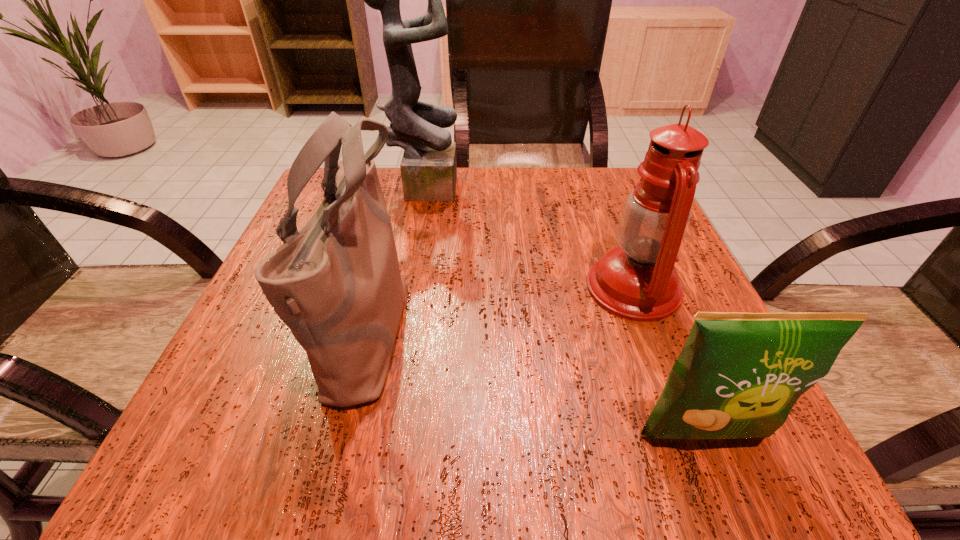
The image size is (960, 540). I want to click on the farthest object, so click(428, 167).

The image size is (960, 540). What are the coordinates of `sculpture` in the screenshot? It's located at (428, 167).

Image resolution: width=960 pixels, height=540 pixels. I want to click on shoulder bag, so click(x=336, y=283).

Find the location of a particular element. The width and height of the screenshot is (960, 540). oil lamp is located at coordinates (637, 281).

The height and width of the screenshot is (540, 960). I want to click on crisp (potato chip), so click(738, 375).

Image resolution: width=960 pixels, height=540 pixels. What are the coordinates of `vacant space located on the face of the tallest object` in the screenshot? It's located at (614, 185).

I want to click on free spot located 0.180m on the front-facing side of the shoulder bag, so click(x=521, y=327).

Find the location of a particular element. The image size is (960, 540). vacant space located on the left of the oil lamp is located at coordinates (373, 288).

This screenshot has width=960, height=540. I want to click on object that is at the far edge, so click(x=428, y=167).

Locate an element on the screen. The image size is (960, 540). shoulder bag that is at the near edge is located at coordinates (336, 283).